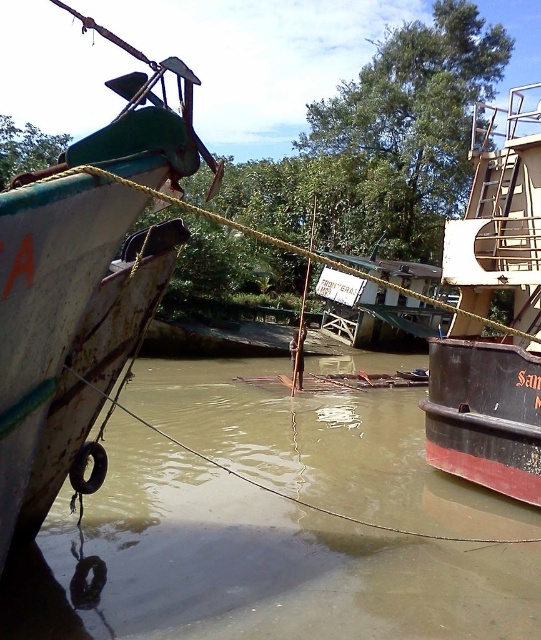
Question: Does rusty metal boat at left have a larger size compared to rusty metal boat at right?

Choices:
 (A) no
 (B) yes

Answer: (B)

Question: Which object is closer to the camera taking this photo?

Choices:
 (A) rusty metal boat at left
 (B) rusty metal boat at right
 (C) brown matte water at center

Answer: (A)

Question: Considering the relative positions of brown matte water at center and rusty metal boat at right in the image provided, where is brown matte water at center located with respect to rusty metal boat at right?

Choices:
 (A) above
 (B) below

Answer: (B)

Question: Which of the following is the farthest from the observer?

Choices:
 (A) brown matte water at center
 (B) rusty metal boat at left

Answer: (A)

Question: Is rusty metal boat at left smaller than rusty metal boat at right?

Choices:
 (A) no
 (B) yes

Answer: (A)

Question: Among these objects, which one is farthest from the camera?

Choices:
 (A) brown matte water at center
 (B) rusty metal boat at left

Answer: (A)